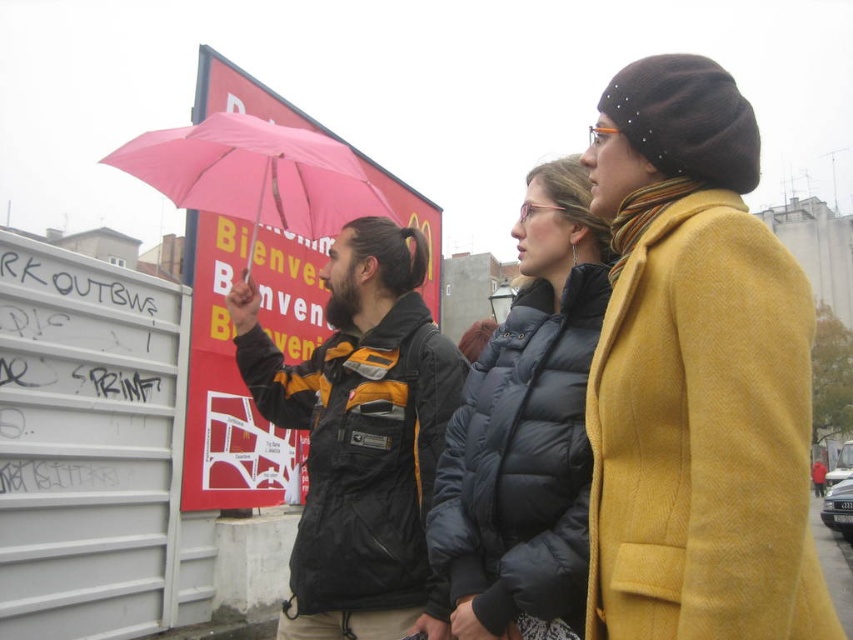
Question: Estimate the real-world distances between objects in this image. Which object is closer to the pink matte umbrella at upper center?

Choices:
 (A) black and yellow jacket at center
 (B) matte black puffer jacket at center
 (C) mustard woolen coat at right

Answer: (A)

Question: Which object is the farthest from the pink matte umbrella at upper center?

Choices:
 (A) black and yellow jacket at center
 (B) matte black puffer jacket at center

Answer: (B)

Question: Is mustard woolen coat at right thinner than pink matte umbrella at upper center?

Choices:
 (A) yes
 (B) no

Answer: (A)

Question: Observing the image, what is the correct spatial positioning of black and yellow jacket at center in reference to matte black puffer jacket at center?

Choices:
 (A) below
 (B) above

Answer: (A)

Question: Is matte black puffer jacket at center wider than pink matte umbrella at upper center?

Choices:
 (A) yes
 (B) no

Answer: (B)

Question: Which object is positioned farthest from the black and yellow jacket at center?

Choices:
 (A) matte black puffer jacket at center
 (B) pink matte umbrella at upper center
 (C) mustard woolen coat at right

Answer: (C)